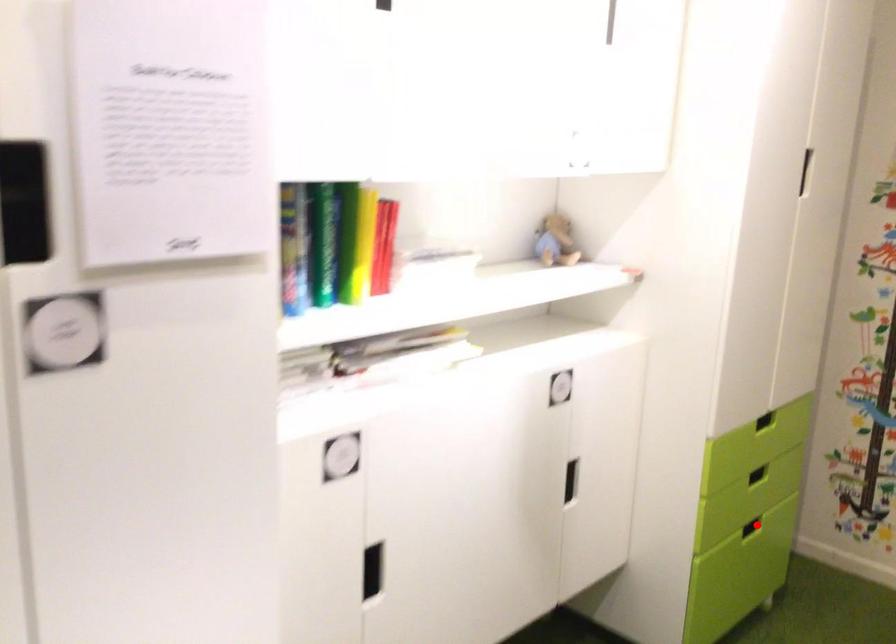
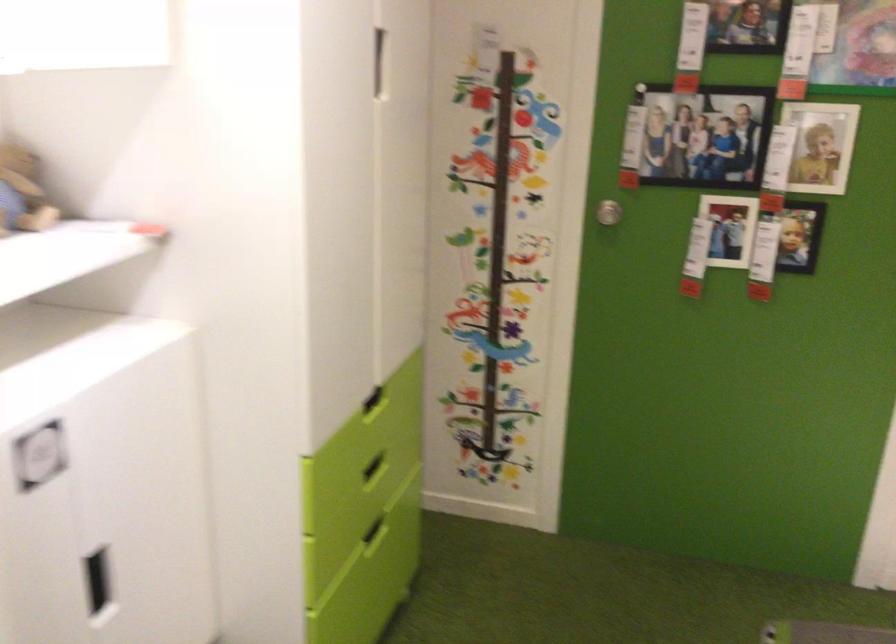
Question: I am providing you with two images of the same scene from different viewpoints. In image1, a red point is highlighted. Considering the same 3D point in image2, which of the following is correct?

Choices:
 (A) It is closer
 (B) It is farther

Answer: (A)